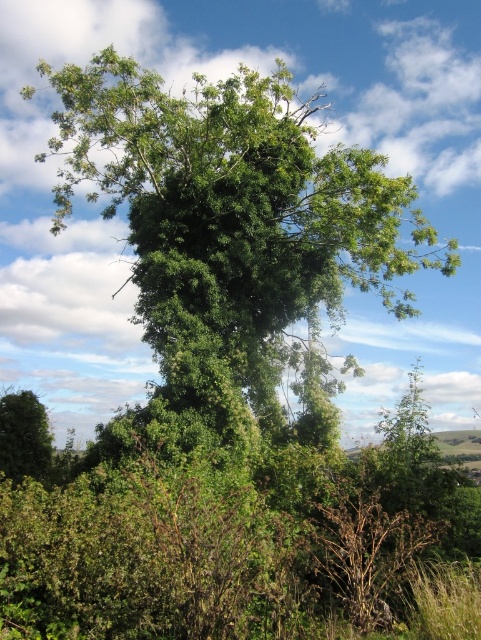
You are standing at point (231, 216) in the image. What object is directly in front of you?

The green leafy tree at center is directly in front of you at point (231, 216).

You are standing in a park and see the green leafy tree at center. If you want to take a photo of it from a distance of exactly 15 meters, would you need to move closer or farther away?

The green leafy tree at center is 15.26 meters away. To achieve a distance of 15 meters, you would need to move closer by approximately 0.26 meters.

You are standing in front of a large tree with two points marked on the ground. One point is at coordinates point (147, 292) and the other is at point (36, 397). Which point is closer to you?

Point (147, 292) is closer to the viewer than point (36, 397).